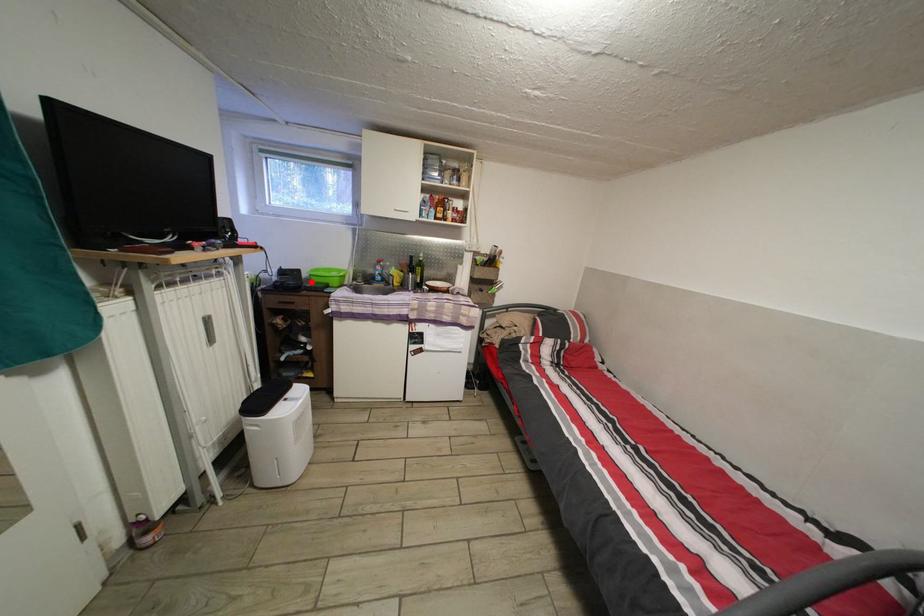
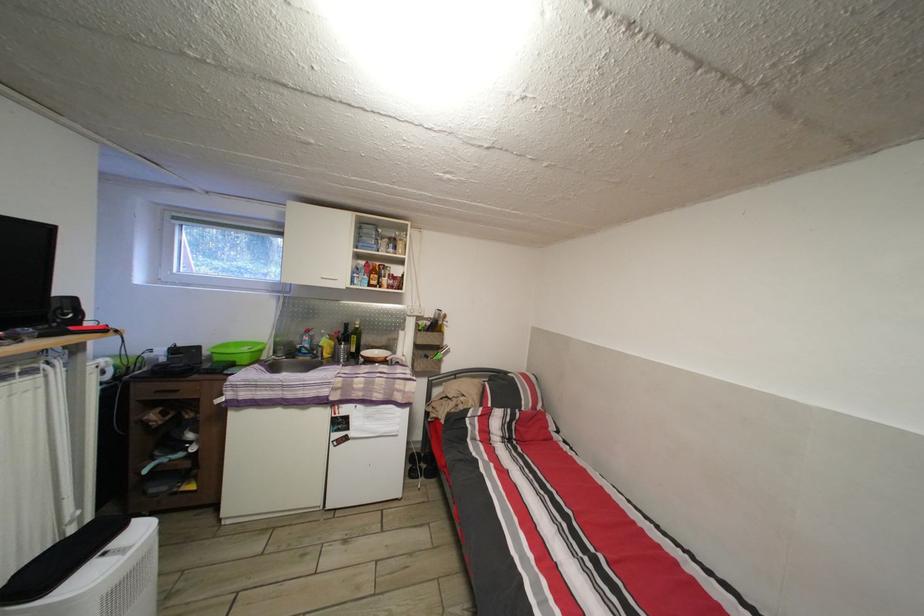
The point at the highlighted location is marked in the first image. Where is the corresponding point in the second image?

(213, 359)